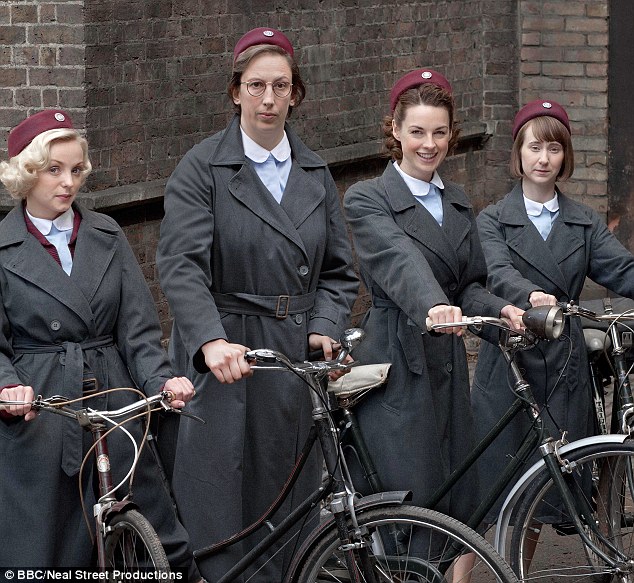
The width and height of the screenshot is (634, 583). What are the coordinates of `brick walls` in the screenshot? It's located at (163, 71), (49, 61).